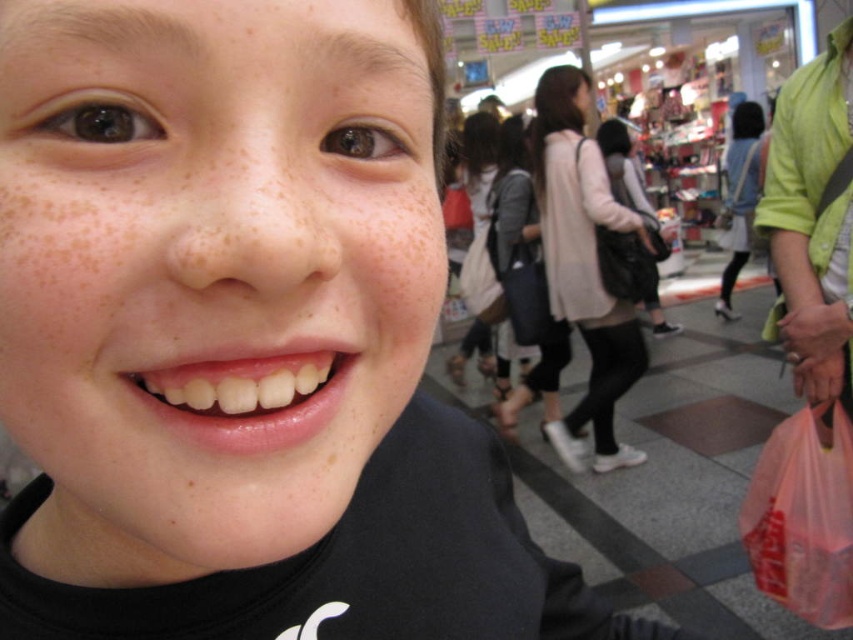
You are a delivery person who needs to place a package on the light pink fabric bag at center. The package is 12 inches long and 8 inches wide. Can you fit it on the bag?

The light pink fabric bag at center is located at point (583, 264). However, without knowing the bag dimensions, it is impossible to determine if the package will fit. Please provide more information about the bag size.

You are standing in a shopping mall and see a light pink fabric bag at center. If you want to pick it up, is it within your reach without moving your feet?

The light pink fabric bag at center is 8.73 feet away from the viewer, which is too far to reach without moving your feet.

You are a photographer trying to capture both the light pink fabric bag at center and the pink plastic bag at lower right in the same frame. Which bag is closer to you, the photographer?

The light pink fabric bag at center is closer to you since it is positioned further to the viewer than the pink plastic bag at lower right.